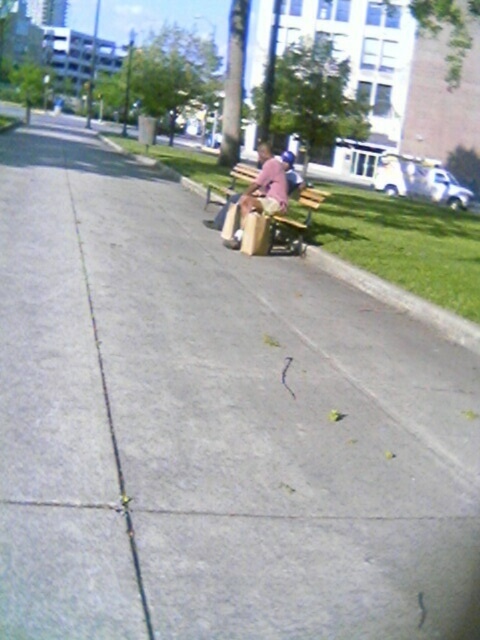
Between point (274, 218) and point (225, 209), which one is positioned in front?

Point (274, 218) is in front.

Find the location of `wooden bench at center`. wooden bench at center is located at coordinates (271, 208).

Does green grass at lower right have a lesser height compared to wooden park bench at center?

In fact, green grass at lower right may be taller than wooden park bench at center.

Describe the element at coordinates (399, 300) in the screenshot. The height and width of the screenshot is (640, 480). I see `green grass at lower right` at that location.

Is point (440, 312) in front of point (298, 221)?

Yes, point (440, 312) is closer to viewer.

The width and height of the screenshot is (480, 640). What are the coordinates of `green grass at lower right` in the screenshot? It's located at pyautogui.click(x=399, y=300).

Is wooden bench at center closer to the viewer compared to green grass at lower right?

No, it is behind green grass at lower right.

Can you confirm if wooden bench at center is positioned to the right of green grass at lower right?

Correct, you'll find wooden bench at center to the right of green grass at lower right.

Which is in front, point (265, 166) or point (448, 316)?

Positioned in front is point (448, 316).

Image resolution: width=480 pixels, height=640 pixels. Find the location of `wooden bench at center`. wooden bench at center is located at coordinates (271, 208).